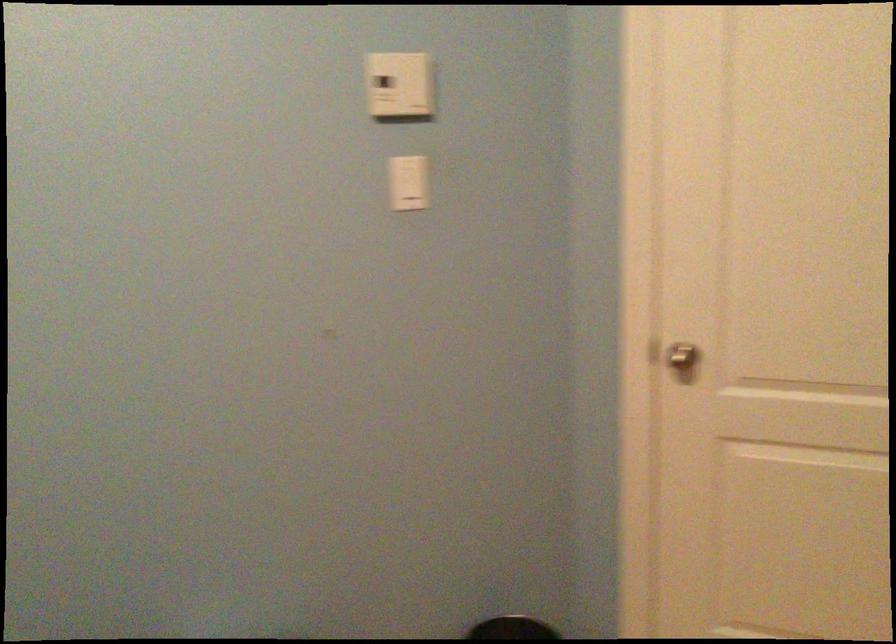
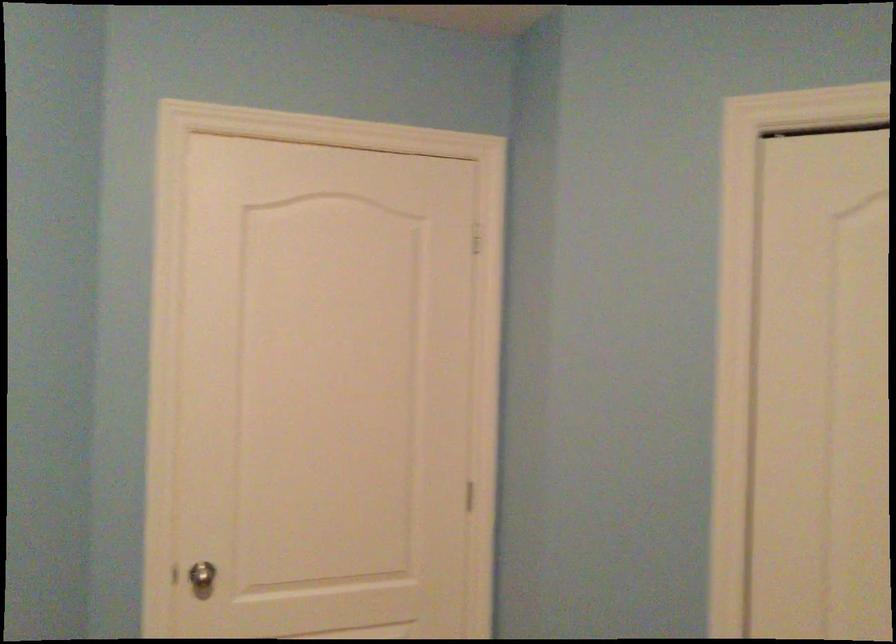
Question: The images are taken continuously from a first-person perspective. In which direction is your viewpoint rotating?

Choices:
 (A) Left
 (B) Right
 (C) Up
 (D) Down

Answer: (B)